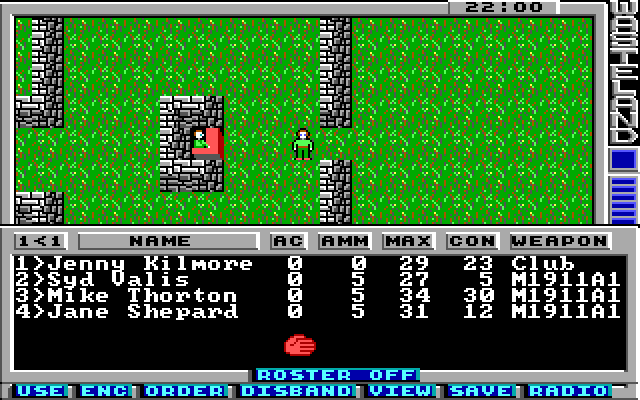
I want to click on black background of table, so point(468,348).